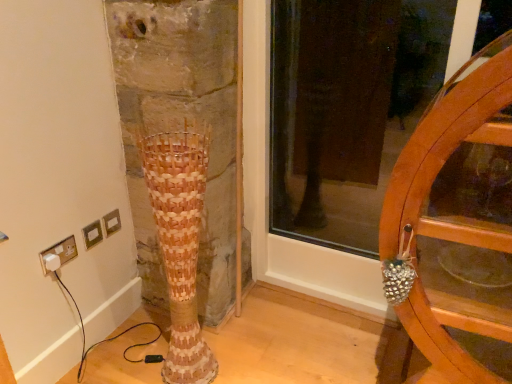
This screenshot has width=512, height=384. In order to click on free point behind woven wood vase at center in this screenshot , I will do pos(205,334).